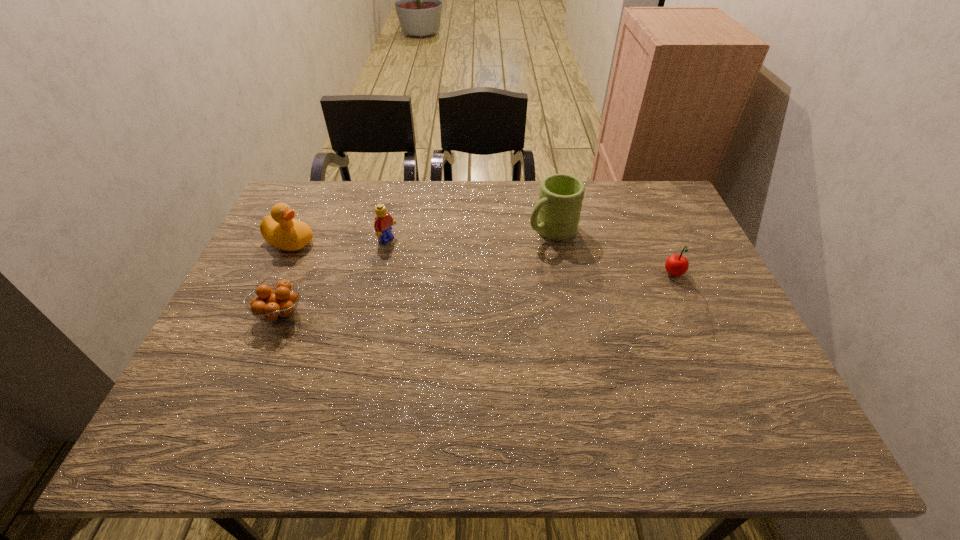
The height and width of the screenshot is (540, 960). Identify the location of unoccupied area between the mug and the nearest object. (417, 272).

The height and width of the screenshot is (540, 960). I want to click on vacant space that is in between the duck and the Lego, so click(x=339, y=241).

Image resolution: width=960 pixels, height=540 pixels. In order to click on free space between the Lego and the orange fruit in this screenshot , I will do `click(334, 277)`.

Find the location of a particular element. free space between the second nearest object and the shortest object is located at coordinates click(x=477, y=295).

This screenshot has width=960, height=540. What are the coordinates of `vacant point located between the duck and the cherry` in the screenshot? It's located at (482, 259).

This screenshot has width=960, height=540. What are the coordinates of `free space between the cherry and the Lego` in the screenshot? It's located at (531, 258).

What are the coordinates of `free space that is in between the duck and the second object from right to left` in the screenshot? It's located at (420, 237).

You are a GUI agent. You are given a task and a screenshot of the screen. Output one action in this format:
    pyautogui.click(x=<x>, y=<y>)
    Task: Click on the free space between the mug and the shortest object
    The width and height of the screenshot is (960, 540).
    Given the screenshot: What is the action you would take?
    pyautogui.click(x=417, y=272)

The width and height of the screenshot is (960, 540). Identify the location of vacant area that lies between the rightmost object and the third object from left to right. (531, 258).

Identify which object is the third closest to the Lego. Please provide its 2D coordinates. Your answer should be formatted as a tuple, i.e. [(x, y)], where the tuple contains the x and y coordinates of a point satisfying the conditions above.

[(556, 215)]